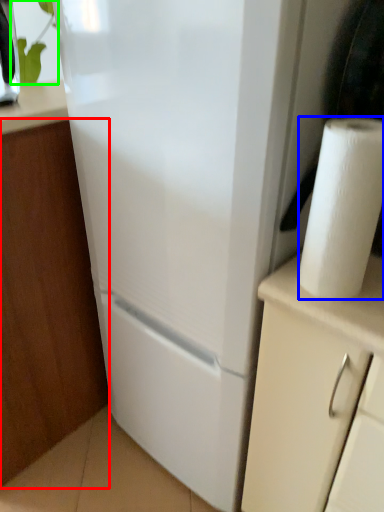
Question: Estimate the real-world distances between objects in this image. Which object is closer to cabinetry (highlighted by a red box), paper towel (highlighted by a blue box) or plant (highlighted by a green box)?

Choices:
 (A) paper towel
 (B) plant

Answer: (A)